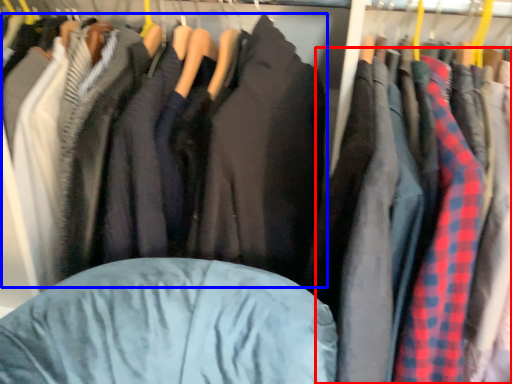
Question: Which of the following is the farthest to the observer, clothing (highlighted by a red box) or jacket (highlighted by a blue box)?

Choices:
 (A) clothing
 (B) jacket

Answer: (B)